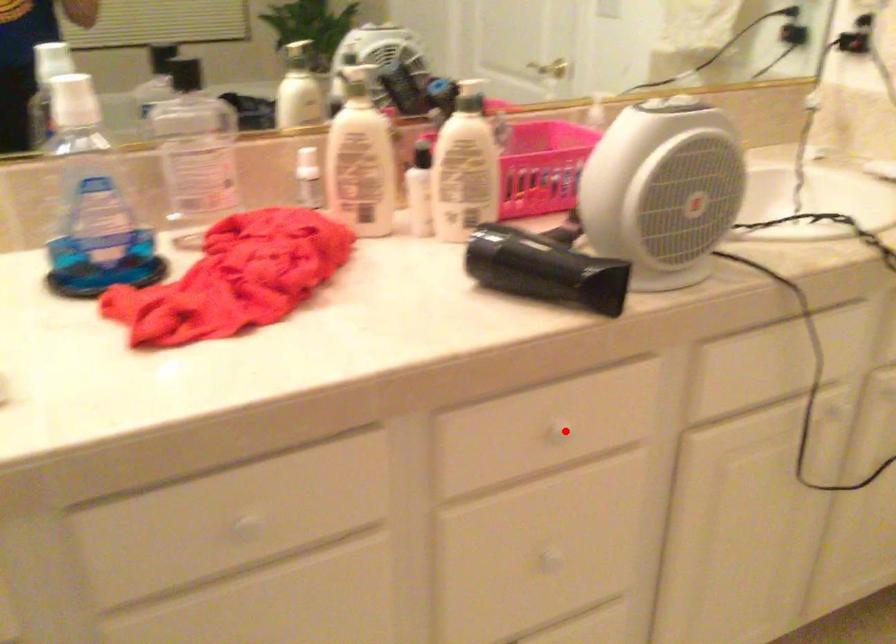
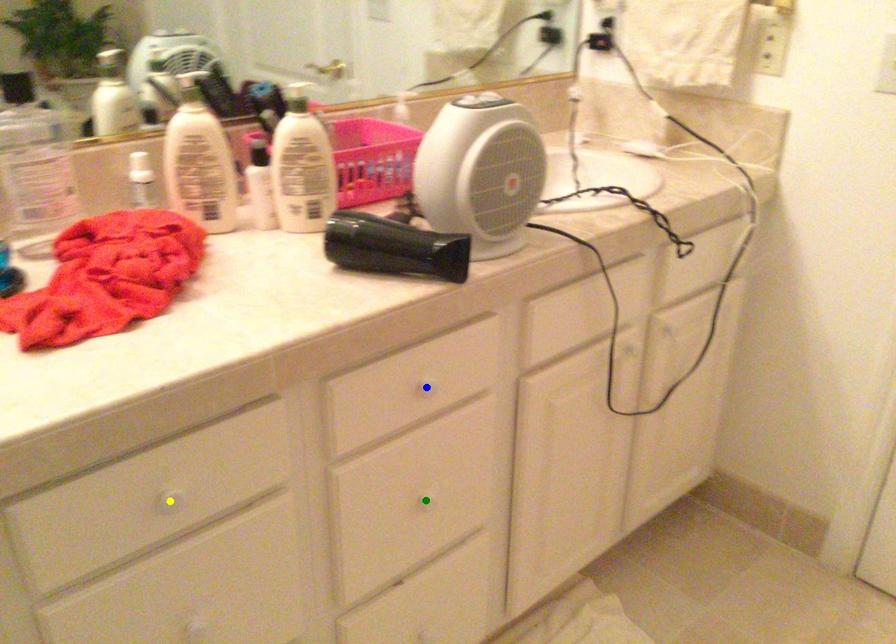
Question: I am providing you with two images of the same scene from different viewpoints. A red point is marked on the first image. You are given multiple points on the second image. Which spot in image 2 lines up with the point in image 1?

Choices:
 (A) blue point
 (B) green point
 (C) yellow point

Answer: (A)